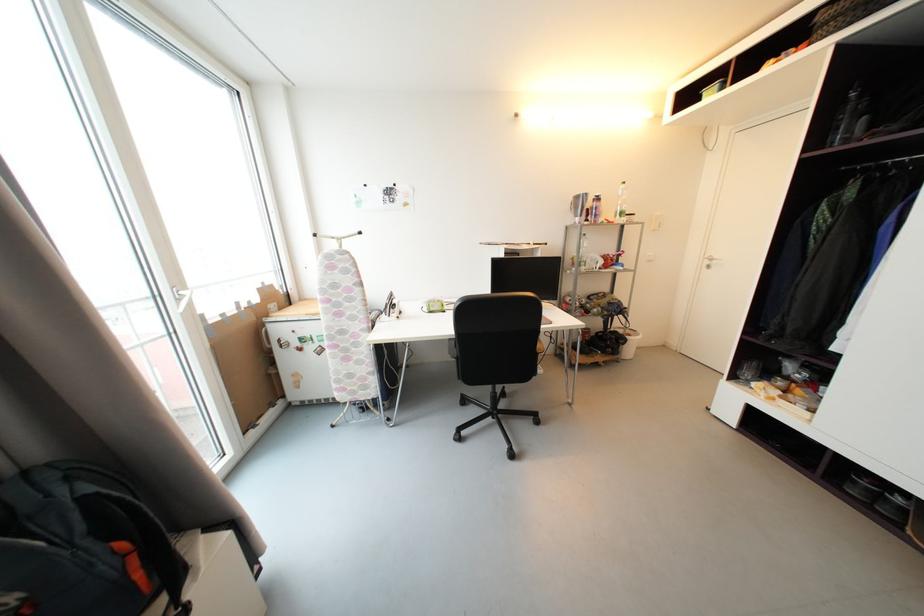
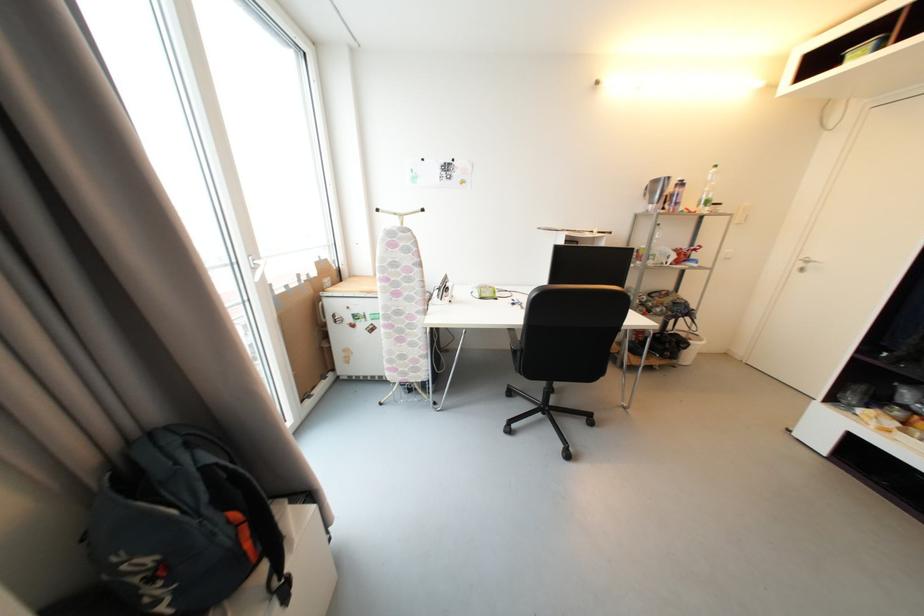
Question: The images are taken continuously from a first-person perspective. In which direction are you moving?

Choices:
 (A) Left
 (B) Right
 (C) Forward
 (D) Backward

Answer: (A)